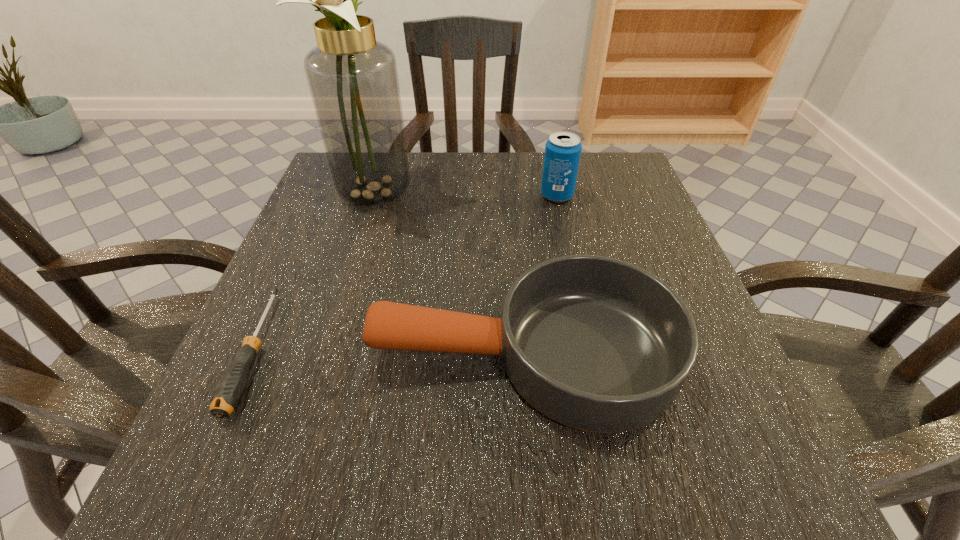
Where is `unoccupied position between the third shortest object and the screwdriver`? unoccupied position between the third shortest object and the screwdriver is located at coordinates (406, 273).

Find the location of `vacant space that's between the screwdriver and the pan`. vacant space that's between the screwdriver and the pan is located at coordinates (390, 353).

At what (x,y) coordinates should I click in order to perform the action: click on free space between the flower arrangement and the screwdriver. Please return your answer as a coordinate pair (x, y). The height and width of the screenshot is (540, 960). Looking at the image, I should click on (319, 272).

Find the location of a particular element. vacant region between the second shortest object and the tallest object is located at coordinates (453, 274).

Identify the location of unoccupied area between the flower arrangement and the screwdriver. (319, 272).

The width and height of the screenshot is (960, 540). Identify the location of unoccupied position between the tallest object and the third shortest object. (469, 194).

Locate which object ranks third in proximity to the second tallest object. Please provide its 2D coordinates. Your answer should be formatted as a tuple, i.e. [(x, y)], where the tuple contains the x and y coordinates of a point satisfying the conditions above.

[(230, 388)]

Select which object appears as the second closest to the screwdriver. Please provide its 2D coordinates. Your answer should be formatted as a tuple, i.e. [(x, y)], where the tuple contains the x and y coordinates of a point satisfying the conditions above.

[(353, 80)]

Find the location of a particular element. blank area in the image that satisfies the following two spatial constraints: 1. on the front side of the tallest object; 2. on the left side of the second tallest object is located at coordinates (381, 195).